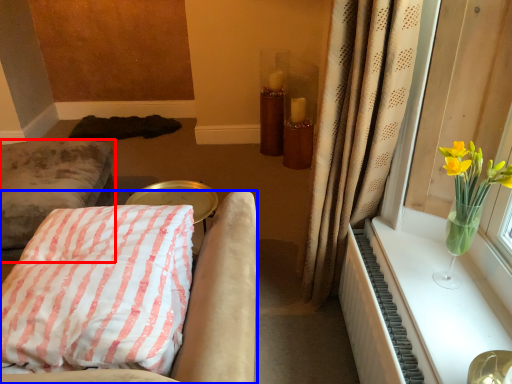
Question: Which of the following is the farthest to the observer, furniture (highlighted by a red box) or furniture (highlighted by a blue box)?

Choices:
 (A) furniture
 (B) furniture

Answer: (A)